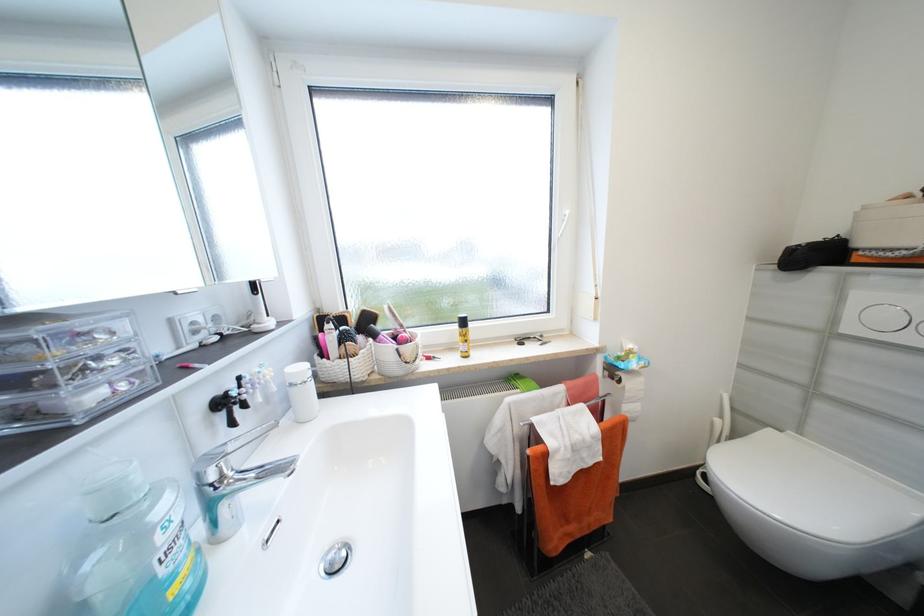
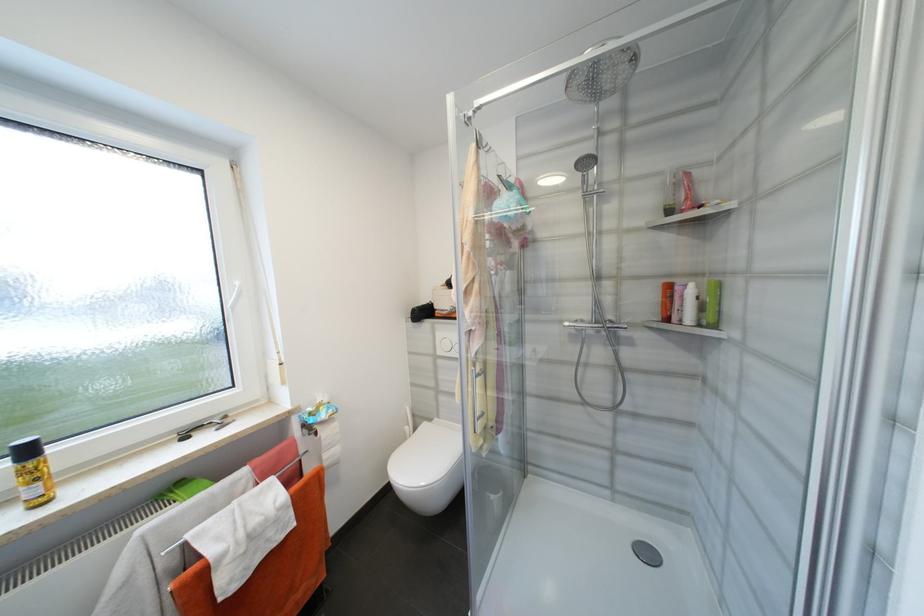
The point at (545, 339) is marked in the first image. Where is the corresponding point in the second image?

(228, 422)